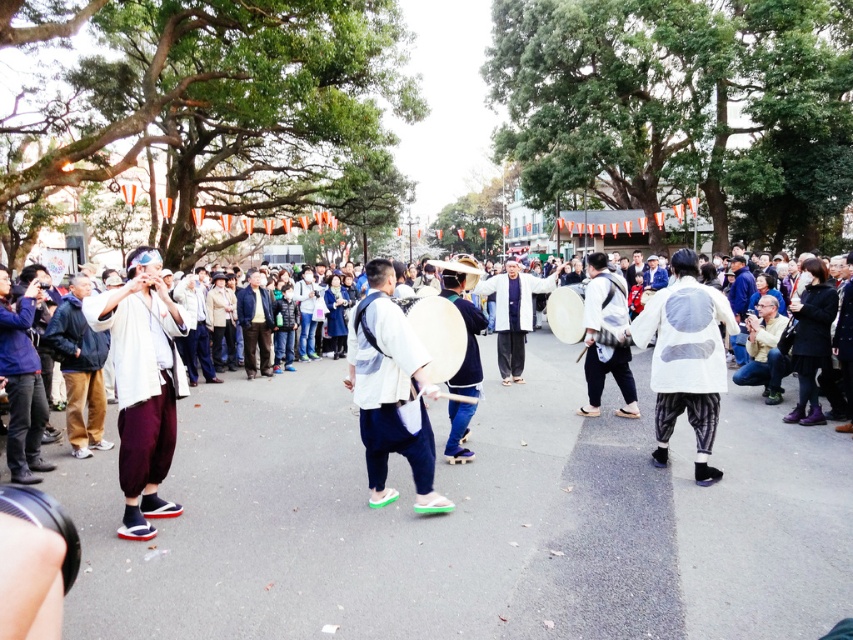
Is the position of white cotton drum at center more distant than that of white cotton kimono at left?

No, it is in front of white cotton kimono at left.

Which is more to the left, white cotton drum at center or white cotton kimono at left?

white cotton kimono at left is more to the left.

At what (x,y) coordinates should I click in order to perform the action: click on white cotton drum at center. Please return your answer as a coordinate pair (x, y). Image resolution: width=853 pixels, height=640 pixels. Looking at the image, I should click on (473, 493).

Find the location of a particular element. This screenshot has height=640, width=853. white cotton drum at center is located at coordinates (473, 493).

Does white cotton kimono at left have a larger size compared to white matte drum at center?

Actually, white cotton kimono at left might be smaller than white matte drum at center.

The height and width of the screenshot is (640, 853). I want to click on white cotton kimono at left, so click(x=142, y=385).

The width and height of the screenshot is (853, 640). What are the coordinates of `white cotton kimono at left` in the screenshot? It's located at (142, 385).

Which is in front, point (517, 442) or point (393, 376)?

Point (393, 376) is more forward.

Which is in front, point (328, 502) or point (387, 417)?

Point (387, 417) is in front.

Where is `white cotton drum at center`? The width and height of the screenshot is (853, 640). white cotton drum at center is located at coordinates (473, 493).